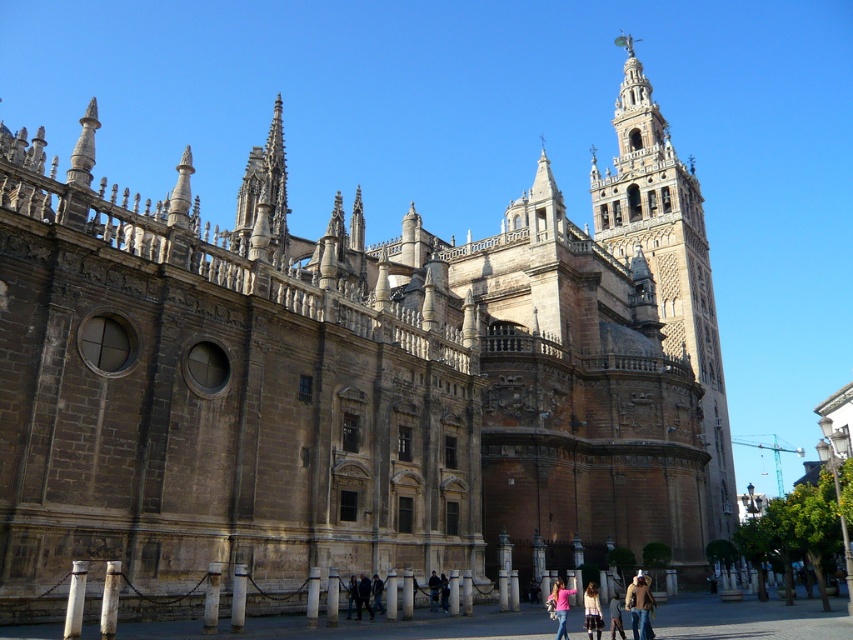
You are an architect visiting the cathedral and want to compare the proportions of the brown stone tower at upper right and the dark brown leather jacket at center. Which object is wider?

The brown stone tower at upper right might be wider than the dark brown leather jacket at center.

You are a tourist visiting the historic cathedral and notice a denim jacket at lower right and dark blue jeans at center. Which item is closer to you as you stand at the entrance?

The denim jacket at lower right is closer to you because it is in front of the dark blue jeans at center.